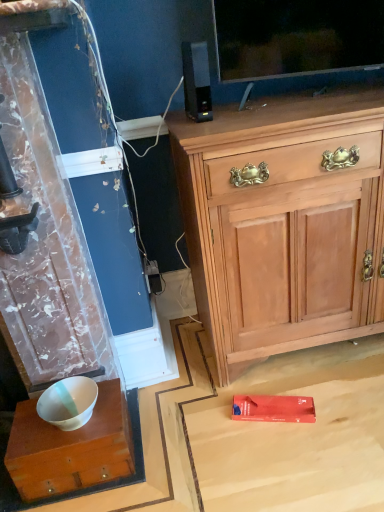
Find the location of `free location to the right of white glossy wood desk at lower left`. free location to the right of white glossy wood desk at lower left is located at coordinates (171, 444).